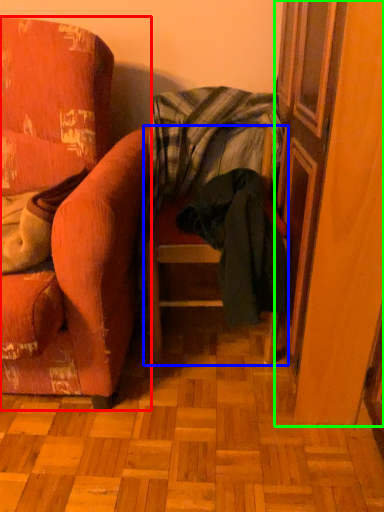
Question: Which is nearer to the chair (highlighted by a red box)? chair (highlighted by a blue box) or screen door (highlighted by a green box).

Choices:
 (A) chair
 (B) screen door

Answer: (A)